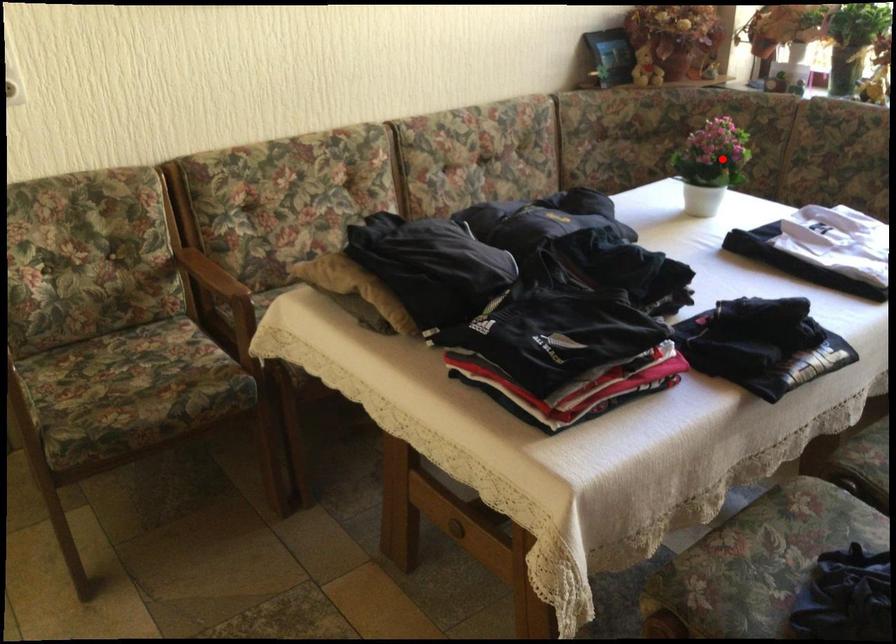
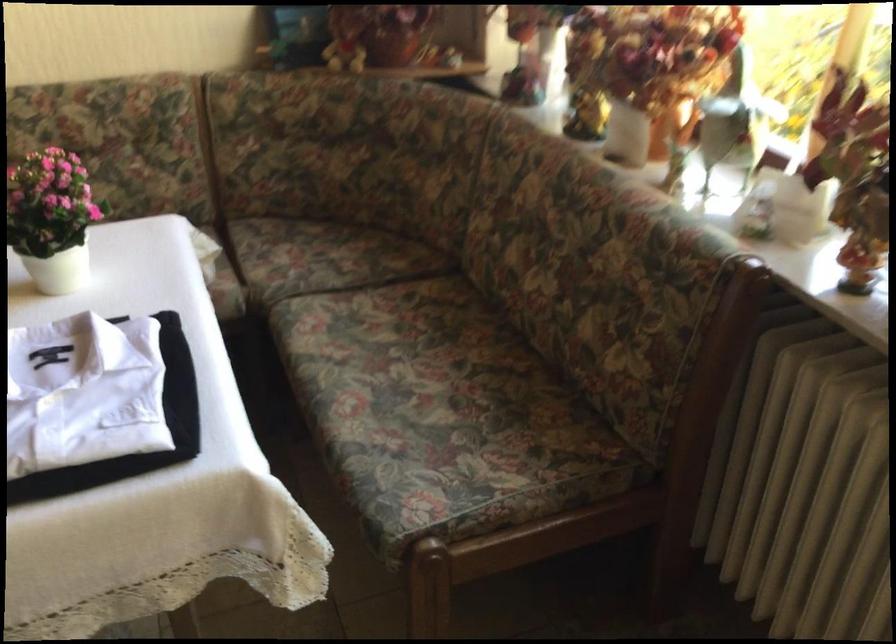
The point at the highlighted location is marked in the first image. Where is the corresponding point in the second image?

(52, 218)